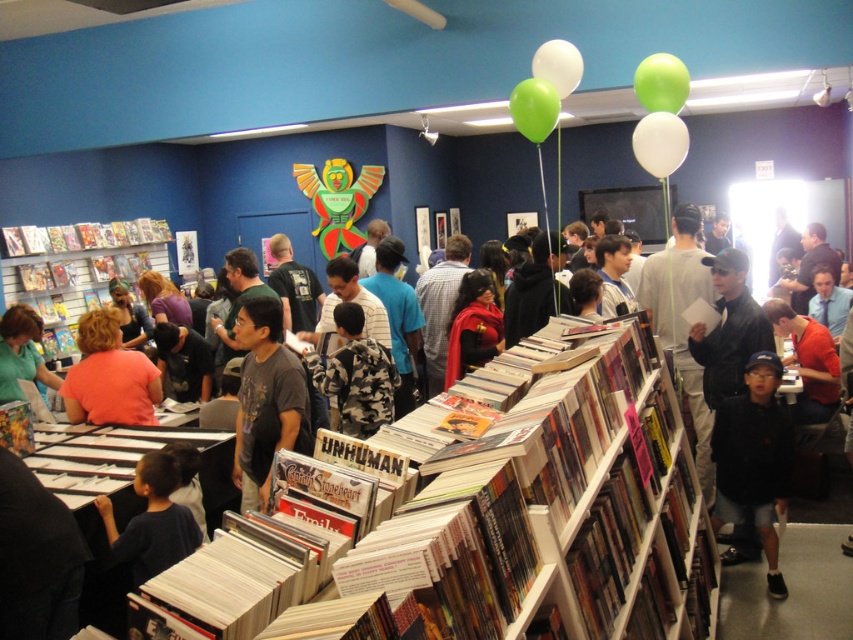
Does hardcover books at center have a greater width compared to matte cardboard bookshelf at left?

Yes.

Measure the distance between hardcover books at center and camera.

hardcover books at center and camera are 1.17 meters apart from each other.

You are a GUI agent. You are given a task and a screenshot of the screen. Output one action in this format:
    pyautogui.click(x=<x>, y=<y>)
    Task: Click on the hardcover books at center
    
    Given the screenshot: What is the action you would take?
    pyautogui.click(x=532, y=499)

Is the position of matte gray t-shirt at center less distant than that of matte cardboard bookshelf at left?

Yes.

Who is more forward, [265,365] or [51,269]?

Positioned in front is point [265,365].

This screenshot has height=640, width=853. In order to click on matte gray t-shirt at center in this screenshot , I will do `click(265, 397)`.

Can you confirm if white matte balloon at upper center is positioned to the left of green rubber balloon at upper right?

Correct, you'll find white matte balloon at upper center to the left of green rubber balloon at upper right.

The height and width of the screenshot is (640, 853). Find the location of `white matte balloon at upper center`. white matte balloon at upper center is located at coordinates (660, 144).